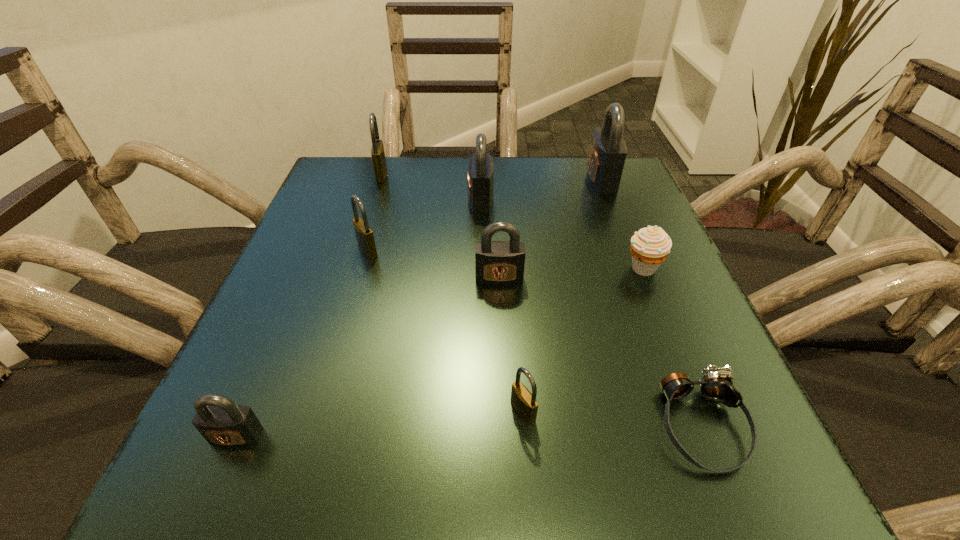
Find the location of a particular element. The image size is (960, 540). muffin that is at the right edge is located at coordinates pyautogui.click(x=650, y=246).

Locate an element on the screen. This screenshot has width=960, height=540. goggles present at the right edge is located at coordinates (715, 386).

Where is `object present at the far left corner`? The height and width of the screenshot is (540, 960). object present at the far left corner is located at coordinates (377, 150).

Image resolution: width=960 pixels, height=540 pixels. In order to click on object located at the near left corner in this screenshot , I will do `click(222, 422)`.

Where is `object that is at the far right corner`? object that is at the far right corner is located at coordinates (608, 152).

Where is `object situated at the near right corner`? The width and height of the screenshot is (960, 540). object situated at the near right corner is located at coordinates (715, 386).

Find the location of a particular element. The height and width of the screenshot is (540, 960). vacant space at the far edge of the desktop is located at coordinates (420, 179).

Where is `vacant space at the near edge of the desktop`? The height and width of the screenshot is (540, 960). vacant space at the near edge of the desktop is located at coordinates (572, 447).

Locate an element on the screen. The width and height of the screenshot is (960, 540). free spot at the left edge of the desktop is located at coordinates (292, 310).

Where is `free region at the far left corner of the desktop`? Image resolution: width=960 pixels, height=540 pixels. free region at the far left corner of the desktop is located at coordinates (330, 169).